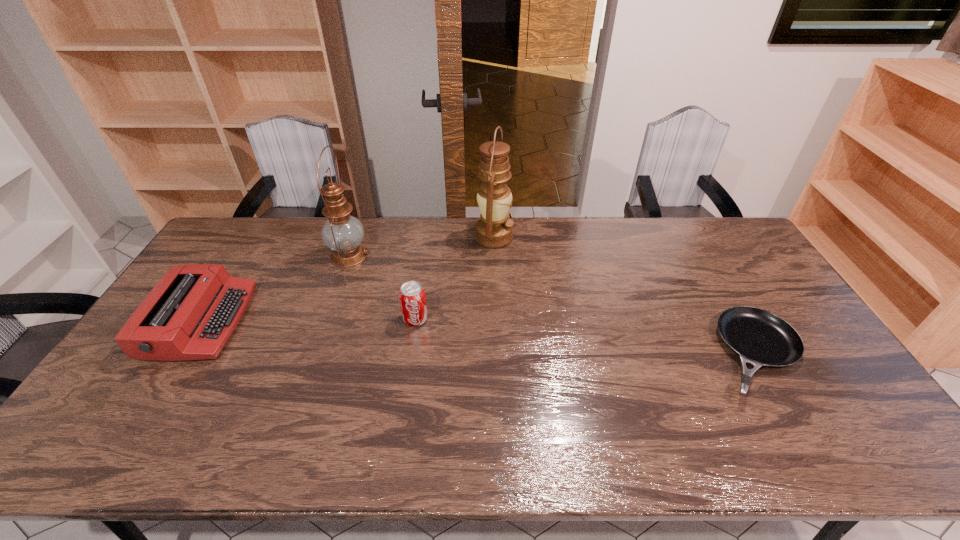
You are a GUI agent. You are given a task and a screenshot of the screen. Output one action in this format:
    pyautogui.click(x=<x>, y=<y>)
    Task: Click on the unoccupied area between the typewriter and the third tallest object
    
    Given the screenshot: What is the action you would take?
    pyautogui.click(x=308, y=321)

At what (x,y) coordinates should I click in order to perform the action: click on vacant space that's between the rightmost object and the third object from right to left. Please return your answer as a coordinate pair (x, y). This screenshot has height=540, width=960. Looking at the image, I should click on (586, 337).

This screenshot has width=960, height=540. I want to click on blank region between the typewriter and the right oil lamp, so click(x=348, y=279).

Locate an element on the screen. The width and height of the screenshot is (960, 540). free point between the right oil lamp and the leftmost object is located at coordinates (348, 279).

This screenshot has width=960, height=540. I want to click on free space between the second shortest object and the second object from left to right, so click(x=275, y=288).

Locate an element on the screen. The width and height of the screenshot is (960, 540). free space between the right oil lamp and the rightmost object is located at coordinates (625, 295).

Where is `vacant area between the pan and the second object from right to left`? The width and height of the screenshot is (960, 540). vacant area between the pan and the second object from right to left is located at coordinates (625, 295).

What are the coordinates of `vacant area that lies between the shortest object and the leftmost object` in the screenshot? It's located at coord(479,338).

The width and height of the screenshot is (960, 540). I want to click on free spot between the soda and the fourth tallest object, so click(x=308, y=321).

Locate an element on the screen. unoccupied area between the shortest object and the second shortest object is located at coordinates (479, 338).